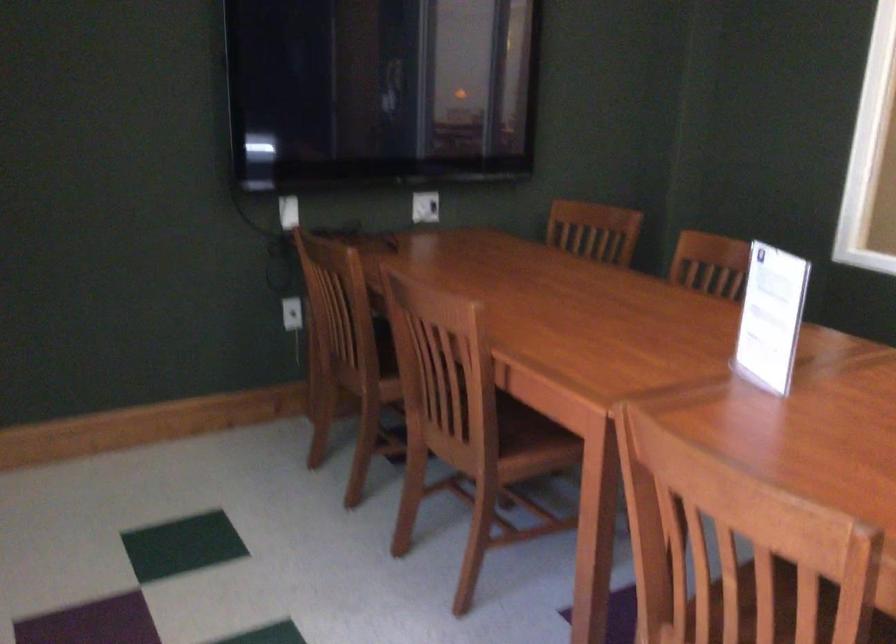
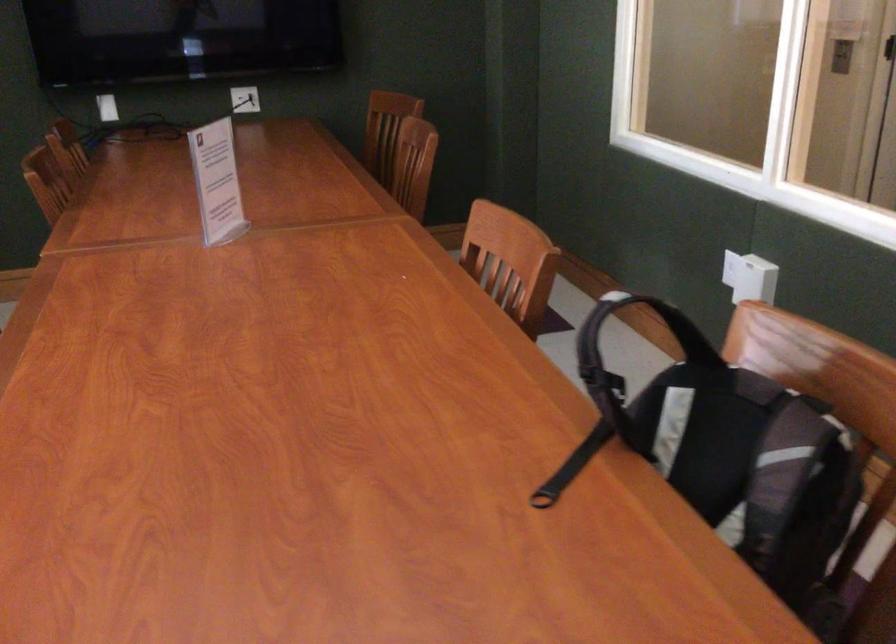
Find the pixel in the second image that matches point (757, 313) in the first image.

(217, 182)